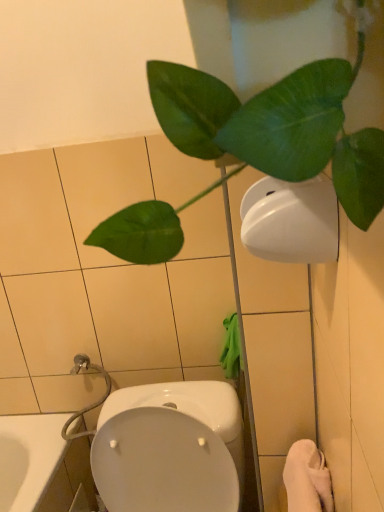
Question: From a real-world perspective, is green matte leafy plant at upper right above or below white matte toilet paper at upper right?

Choices:
 (A) below
 (B) above

Answer: (B)

Question: Does point (192, 104) appear closer or farther from the camera than point (261, 239)?

Choices:
 (A) farther
 (B) closer

Answer: (B)

Question: Estimate the real-world distances between objects in this image. Which object is farther from the white glossy toilet at lower center?

Choices:
 (A) green matte leafy plant at upper right
 (B) white soft towel at lower right
 (C) white matte toilet paper at upper right

Answer: (A)

Question: Estimate the real-world distances between objects in this image. Which object is closer to the white soft towel at lower right?

Choices:
 (A) white glossy toilet at lower center
 (B) green matte leafy plant at upper right
 (C) white matte toilet paper at upper right

Answer: (A)